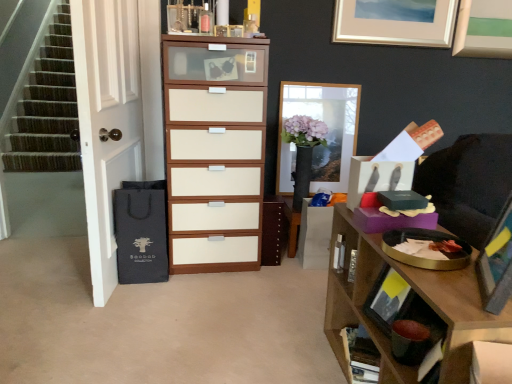
Identify the location of wooden bookshelf at lower right. The height and width of the screenshot is (384, 512). (362, 356).

In order to face brown wood cabinet at center, should I rotate leftwards or rightwards?

To align with it, rotate right about 2.022°.

This screenshot has height=384, width=512. I want to click on matte white wood chest of drawers at center, so click(x=214, y=152).

Where is `wooden picture frame at right, which is counted as the third picture frame, starting from the top`? wooden picture frame at right, which is counted as the third picture frame, starting from the top is located at coordinates (496, 263).

Is brown wood cabinet at center looking in the opposite direction of wooden bookshelf at lower right?

No, brown wood cabinet at center is not facing the opposite direction of wooden bookshelf at lower right.

Would you consider brown wood cabinet at center to be distant from wooden bookshelf at lower right?

No.

Does white glossy door at left have a lesser width compared to wooden picture frame at right, arranged as the 1th picture frame when viewed from the front?

No.

Which of these two, white glossy door at left or wooden picture frame at right, arranged as the 1th picture frame when viewed from the front, is bigger?

white glossy door at left.

Does white glossy door at left turn towards wooden picture frame at right, which is counted as the third picture frame, starting from the top?

No, white glossy door at left is not facing towards wooden picture frame at right, which is counted as the third picture frame, starting from the top.

Between white glossy door at left and wooden picture frame at right, arranged as the 1th picture frame when viewed from the front, which one appears on the left side from the viewer's perspective?

From the viewer's perspective, white glossy door at left appears more on the left side.

In the scene shown: Is matte black drawer at upper right inside or outside of wooden picture frame at right, which is counted as the third picture frame, starting from the top?

matte black drawer at upper right is not inside wooden picture frame at right, which is counted as the third picture frame, starting from the top, it's outside.

Is matte black drawer at upper right wider or thinner than wooden picture frame at right, arranged as the 1th picture frame when viewed from the front?

Clearly, matte black drawer at upper right has more width compared to wooden picture frame at right, arranged as the 1th picture frame when viewed from the front.

Which is more to the left, matte black drawer at upper right or wooden picture frame at right, arranged as the 1th picture frame when viewed from the front?

Positioned to the left is matte black drawer at upper right.

Would you consider matte black drawer at upper right to be distant from wooden picture frame at right, marked as the 1th picture frame in a bottom-to-top arrangement?

No, matte black drawer at upper right is in close proximity to wooden picture frame at right, marked as the 1th picture frame in a bottom-to-top arrangement.

From a real-world perspective, between white glossy door at left and matte silver picture frame at upper center, which is counted as the second picture frame, starting from the back, who is vertically lower?

In real-world perspective, white glossy door at left is lower.

Does point (109, 252) come closer to viewer compared to point (405, 39)?

Yes, it is.

Which object is further away from the camera taking this photo, white glossy door at left or matte silver picture frame at upper center, placed as the 1th picture frame when sorted from top to bottom?

Positioned behind is matte silver picture frame at upper center, placed as the 1th picture frame when sorted from top to bottom.

Which is in front, point (338, 280) or point (293, 150)?

Point (338, 280)

Do you think wooden tray at upper right is within matte white picture frame at center, the third picture frame viewed from the front, or outside of it?

wooden tray at upper right is outside matte white picture frame at center, the third picture frame viewed from the front.

From the picture: What's the angular difference between wooden tray at upper right and matte white picture frame at center, the 2th picture frame when ordered from bottom to top,'s facing directions?

wooden tray at upper right and matte white picture frame at center, the 2th picture frame when ordered from bottom to top, are facing 89.3 degrees away from each other.

Between matte silver picture frame at upper center, which is counted as the second picture frame, starting from the back, and matte black drawer at upper right, which one has more height?

matte silver picture frame at upper center, which is counted as the second picture frame, starting from the back.

Looking at this image, is matte silver picture frame at upper center, placed as the 1th picture frame when sorted from top to bottom, facing away from matte black drawer at upper right?

No, matte silver picture frame at upper center, placed as the 1th picture frame when sorted from top to bottom,'s orientation is not away from matte black drawer at upper right.

Between wooden tray at upper right and matte white wood chest of drawers at center, which one has larger size?

Bigger between the two is matte white wood chest of drawers at center.

Would you say wooden tray at upper right is a long distance from matte white wood chest of drawers at center?

wooden tray at upper right is actually quite close to matte white wood chest of drawers at center.

Does point (336, 289) appear closer or farther from the camera than point (227, 112)?

Point (336, 289) is closer to the camera than point (227, 112).

What are the coordinates of `cabinetry located above the wooden bookshelf at lower right (from a real-world perspective)` in the screenshot? It's located at (273, 230).

This screenshot has height=384, width=512. I want to click on picture frame in front of the white glossy door at left, so click(496, 263).

When comparing their distances from wooden tray at upper right, does matte white wood chest of drawers at center or matte white picture frame at center, the 2th picture frame when ordered from bottom to top, seem closer?

The object closer to wooden tray at upper right is matte white wood chest of drawers at center.

From the image, which object appears to be farther from matte white picture frame at center, the third picture frame viewed from the front, wooden tray at upper right or matte white wood chest of drawers at center?

The object further to matte white picture frame at center, the third picture frame viewed from the front, is wooden tray at upper right.

Based on their spatial positions, is wooden picture frame at right, which is counted as the third picture frame, starting from the top, or wooden tray at upper right closer to brown wood cabinet at center?

wooden tray at upper right.

Looking at the image, which one is located further to matte silver picture frame at upper center, which is counted as the second picture frame, starting from the back, matte black drawer at upper right or brown wood cabinet at center?

matte black drawer at upper right is further to matte silver picture frame at upper center, which is counted as the second picture frame, starting from the back.

Consider the image. Considering their positions, is matte white picture frame at center, the 2th picture frame when ordered from bottom to top, positioned closer to matte black drawer at upper right than white glossy door at left?

matte white picture frame at center, the 2th picture frame when ordered from bottom to top, is positioned closer to the anchor matte black drawer at upper right.

Based on their spatial positions, is brown wood cabinet at center or wooden picture frame at right, which is counted as the third picture frame, starting from the top, closer to matte white picture frame at center, the 2th picture frame when ordered from bottom to top?

Among the two, brown wood cabinet at center is located nearer to matte white picture frame at center, the 2th picture frame when ordered from bottom to top.

Which object lies nearer to the anchor point matte silver picture frame at upper center, which is counted as the second picture frame, starting from the back, brown wood cabinet at center or white glossy door at left?

brown wood cabinet at center.

From the image, which object appears to be nearer to brown wood cabinet at center, wooden tray at upper right or wooden picture frame at right, marked as the 1th picture frame in a bottom-to-top arrangement?

Result: Among the two, wooden tray at upper right is located nearer to brown wood cabinet at center.

The image size is (512, 384). I want to click on cabinet between white glossy door at left and matte silver picture frame at upper center, placed as the 1th picture frame when sorted from top to bottom, in the horizontal direction, so click(x=362, y=356).

This screenshot has width=512, height=384. Identify the location of drawer between wooden tray at upper right and matte white picture frame at center, marked as the first picture frame in a back-to-front arrangement, from front to back. (391, 220).

This screenshot has height=384, width=512. In order to click on cabinetry located between matte black drawer at upper right and matte white picture frame at center, marked as the first picture frame in a back-to-front arrangement, in the depth direction in this screenshot , I will do `click(273, 230)`.

Locate an element on the screen. This screenshot has height=384, width=512. drawer between wooden picture frame at right, which is counted as the third picture frame, starting from the top, and matte white wood chest of drawers at center from front to back is located at coordinates (391, 220).